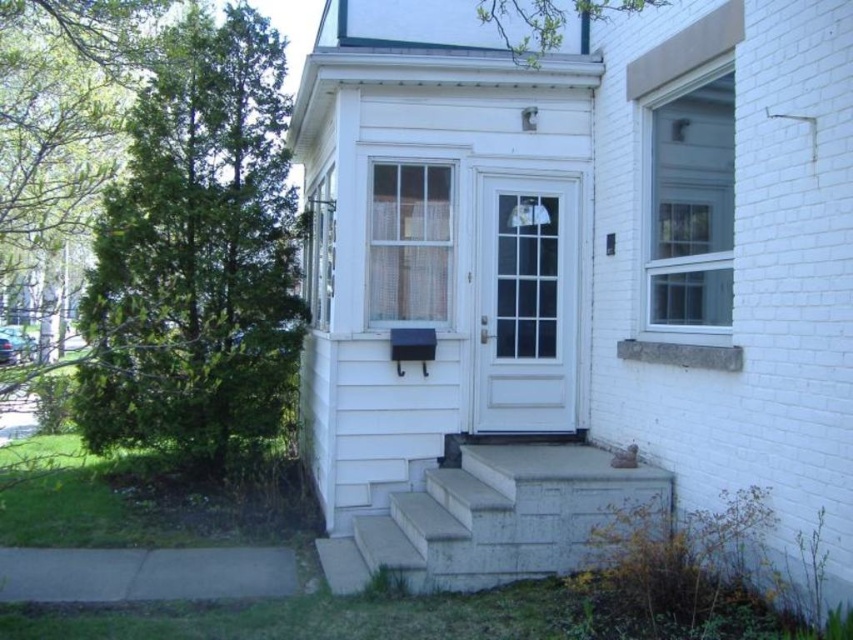
Does concrete at center appear on the left side of white glossy door at center?

Correct, you'll find concrete at center to the left of white glossy door at center.

Is concrete at center bigger than white glossy door at center?

Yes.

Image resolution: width=853 pixels, height=640 pixels. What do you see at coordinates (491, 518) in the screenshot?
I see `concrete at center` at bounding box center [491, 518].

This screenshot has width=853, height=640. Find the location of `concrete at center`. concrete at center is located at coordinates (x=491, y=518).

Identify the location of white glossy door at center. This screenshot has height=640, width=853. (525, 304).

Can you confirm if concrete at center is taller than concrete/stone steps at lower center?

Indeed, concrete at center has a greater height compared to concrete/stone steps at lower center.

The height and width of the screenshot is (640, 853). In order to click on concrete at center in this screenshot , I will do `click(491, 518)`.

I want to click on concrete at center, so click(x=491, y=518).